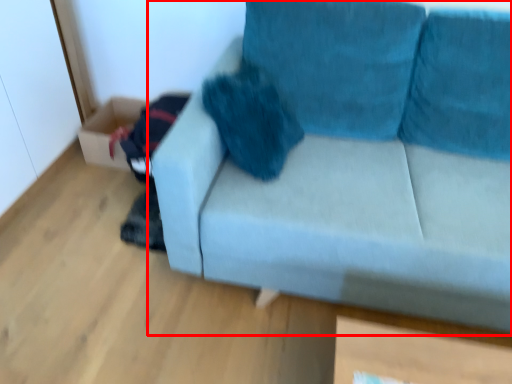
Question: From the image's perspective, considering the relative positions of studio couch (annotated by the red box) and box in the image provided, where is studio couch (annotated by the red box) located with respect to the staircase?

Choices:
 (A) below
 (B) above

Answer: (A)